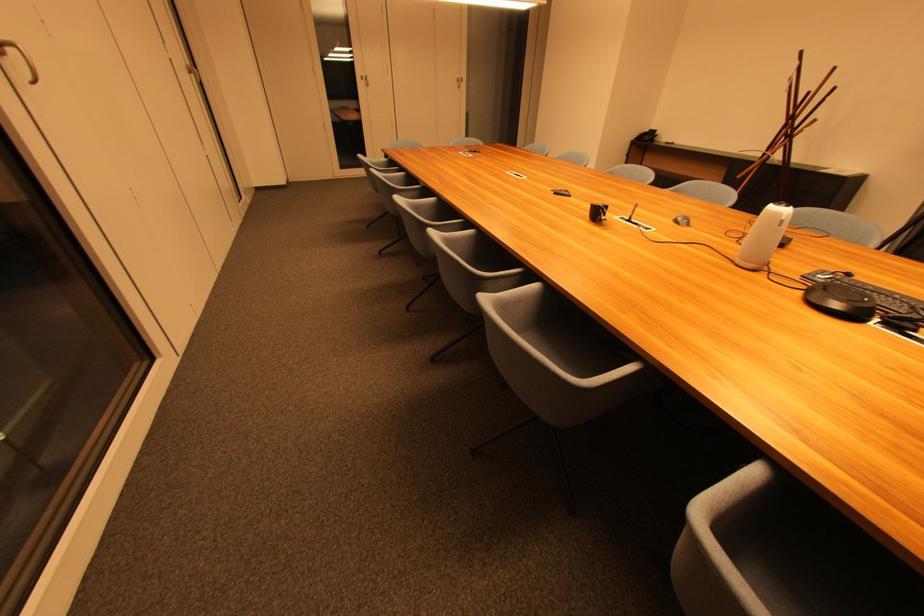
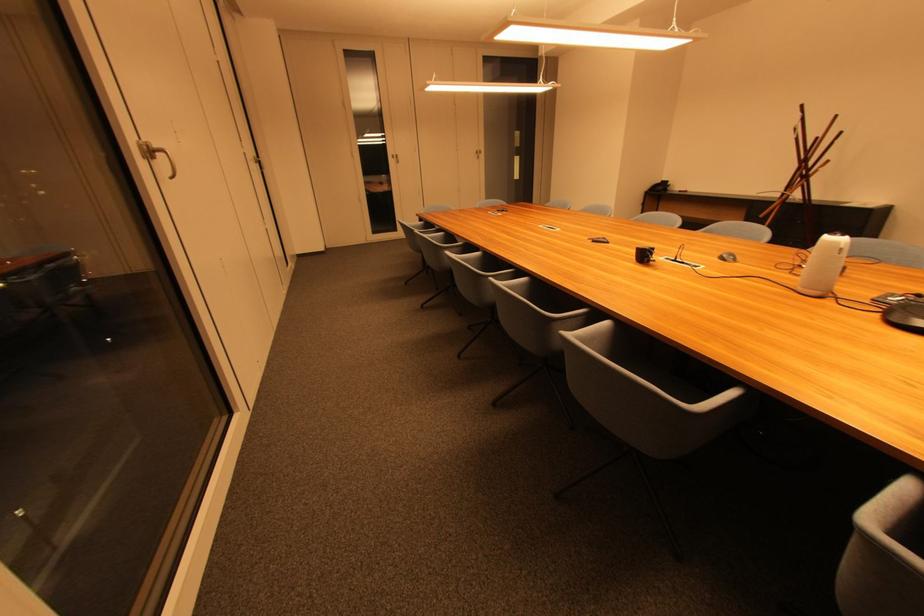
The point at (681,224) is marked in the first image. Where is the corresponding point in the second image?

(726, 261)